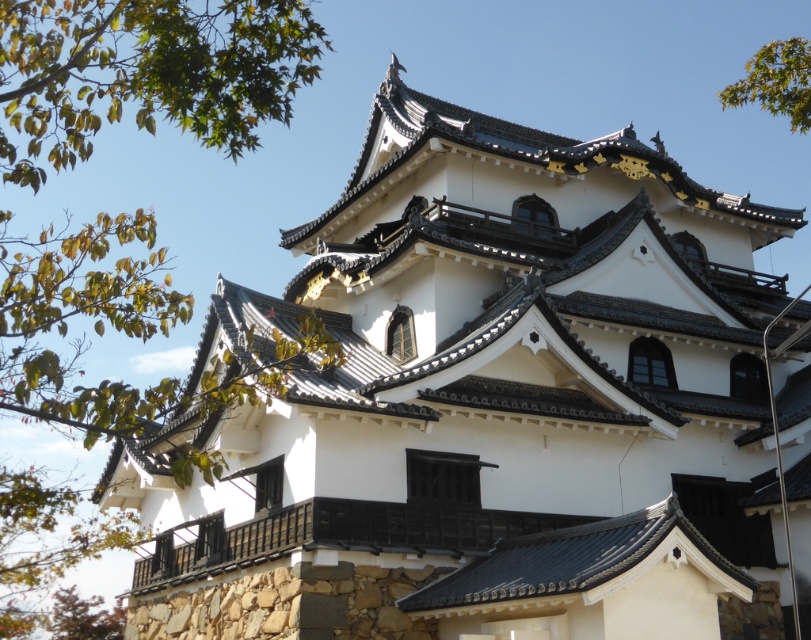
You are standing in front of a traditional Japanese building and notice a point marked at coordinates (144, 72). What object is located at that point?

The point at (144, 72) marks the location of a green leafy tree at upper left.

You are an architect designing a garden layout for the historical building. You need to place two green leafy trees symmetrically. Given the current positions of the green leafy tree at upper left and green leafy tree at upper right, do their widths allow for a symmetrical arrangement?

The green leafy tree at upper left might be wider than green leafy tree at upper right, so their widths may not allow for a perfectly symmetrical arrangement since one is potentially wider than the other.